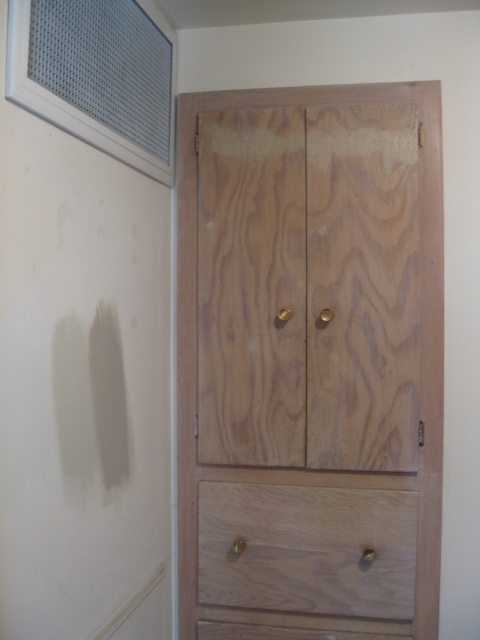
Is natural wood dresser at center positioned in front of natural wood drawer at lower center?

Yes.

Can you confirm if natural wood dresser at center is positioned to the left of natural wood drawer at lower center?

Yes, natural wood dresser at center is to the left of natural wood drawer at lower center.

Locate an element on the screen. natural wood dresser at center is located at coordinates (310, 362).